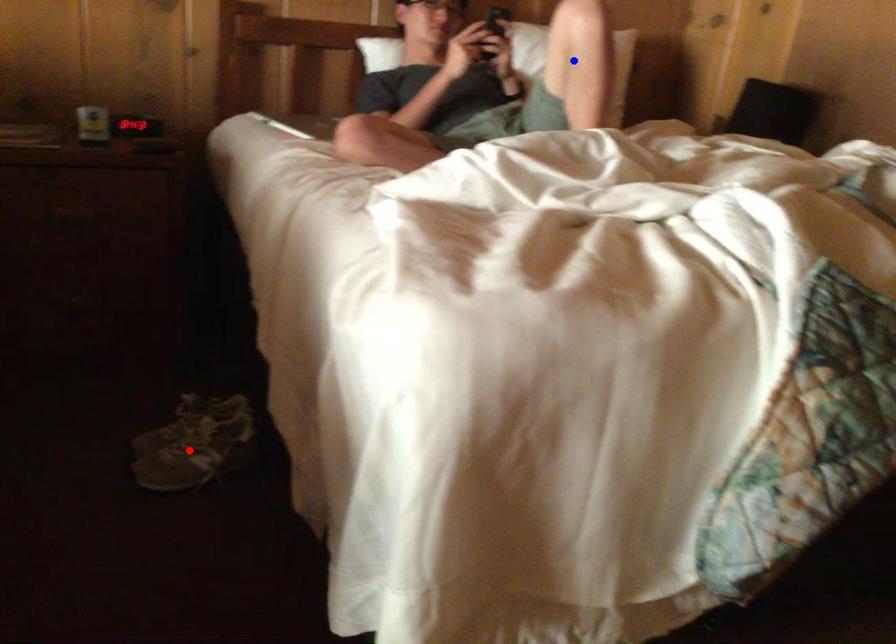
Question: In the image, two points are highlighted. Which point is nearer to the camera? Reply with the corresponding letter.

Choices:
 (A) blue point
 (B) red point

Answer: (B)